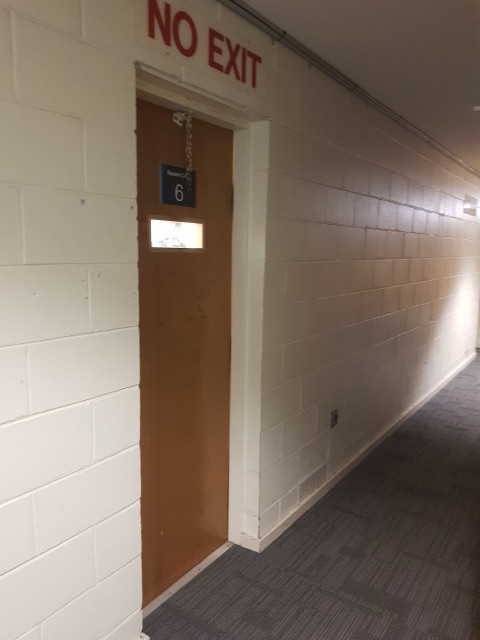
Identify the location of floor. (437, 550).